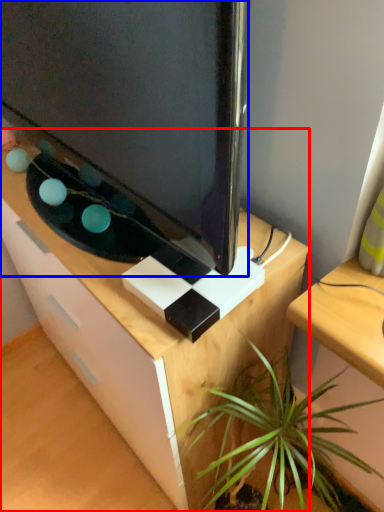
Question: Which point is further to the camera, desk (highlighted by a red box) or television (highlighted by a blue box)?

Choices:
 (A) desk
 (B) television

Answer: (A)